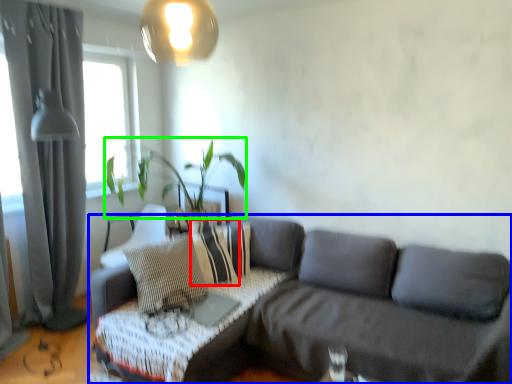
Question: Which object is positioned closest to pillow (highlighted by a red box)? Select from studio couch (highlighted by a blue box) and plant (highlighted by a green box).

Choices:
 (A) studio couch
 (B) plant

Answer: (A)